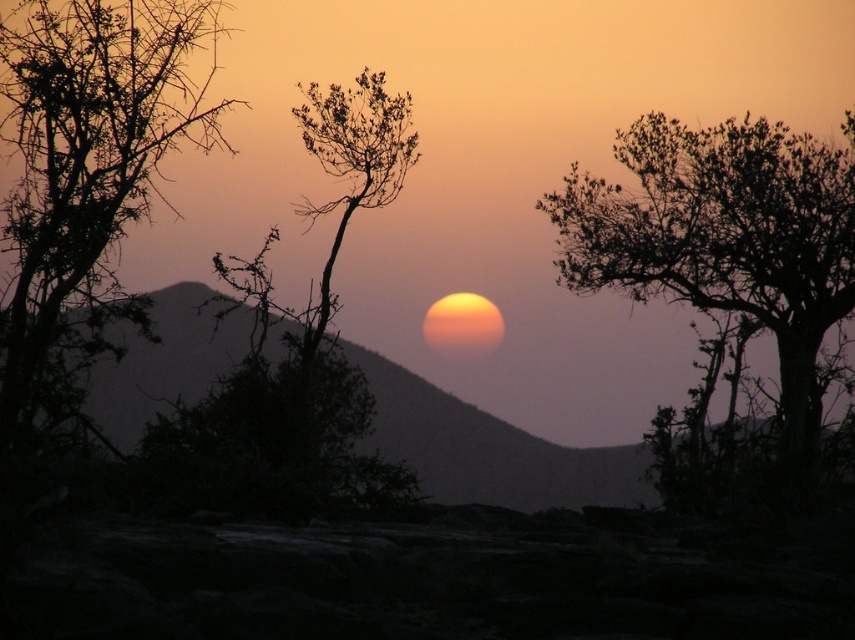
Question: Which of these objects is positioned farthest from the silhouette leafy tree at upper right?

Choices:
 (A) bare branches at center
 (B) silhouette leafy tree at left

Answer: (B)

Question: Where is silhouette leafy tree at upper right located in relation to bare branches at center in the image?

Choices:
 (A) below
 (B) above

Answer: (B)

Question: Does silhouette leafy tree at upper right appear on the right side of bare branches at center?

Choices:
 (A) no
 (B) yes

Answer: (B)

Question: Which object is the closest to the silhouette leafy tree at upper right?

Choices:
 (A) silhouette leafy tree at left
 (B) bare branches at center

Answer: (B)

Question: Is silhouette leafy tree at left positioned before bare branches at center?

Choices:
 (A) no
 (B) yes

Answer: (B)

Question: Based on their relative distances, which object is nearer to the bare branches at center?

Choices:
 (A) silhouette leafy tree at upper right
 (B) silhouette leafy tree at left

Answer: (B)